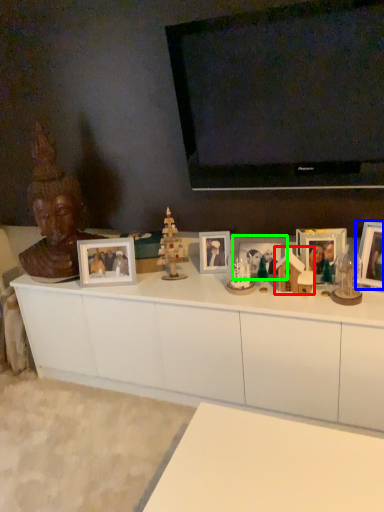
Question: Considering the real-world distances, which object is closest to toy (highlighted by a red box)? picture frame (highlighted by a blue box) or picture frame (highlighted by a green box).

Choices:
 (A) picture frame
 (B) picture frame

Answer: (B)